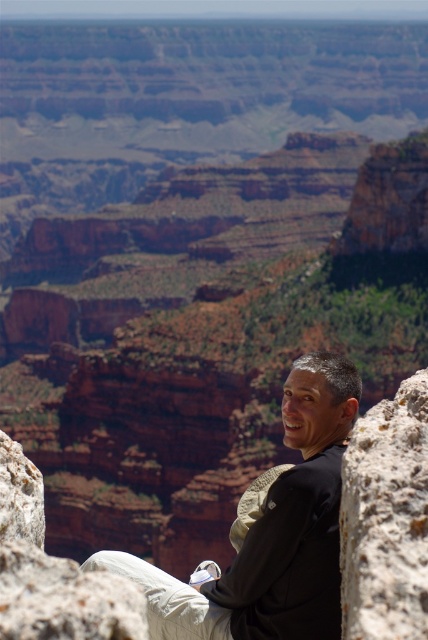
You are a photographer planning to capture a landscape shot of the Grand Canyon. You notice the matte black shirt at center and the rusty rock at right in your frame. Which object should you adjust to ensure the composition follows the rule of thirds?

To follow the rule of thirds, you should move the rusty rock at right slightly to the right so that the matte black shirt at center aligns with the left intersection point and the rusty rock at right aligns with the right intersection point of the rule of thirds grid.

You are planning to take a photo of the matte black shirt at center and the rusty rock at right. Which object should you zoom in on to ensure both fit in the frame without cropping?

The rusty rock at right is narrower than the matte black shirt at center, so you should zoom in on the matte black shirt at center to ensure both fit in the frame without cropping.

You are a photographer planning to capture a photo of the matte black shirt at center and the rusty rock at right. Based on their positions, which object should you focus on first to ensure both are in sharp focus?

The matte black shirt at center should be focused on first because it is much taller than the rusty rock at right, so focusing on the closer object first would help achieve sharp focus on both.